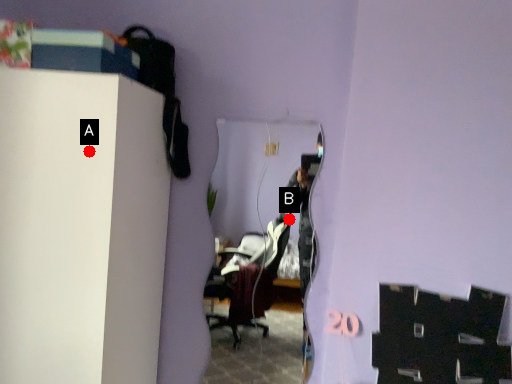
Question: Two points are circled on the image, labeled by A and B beside each circle. Which point appears closest to the camera in this image?

Choices:
 (A) A is closer
 (B) B is closer

Answer: (A)